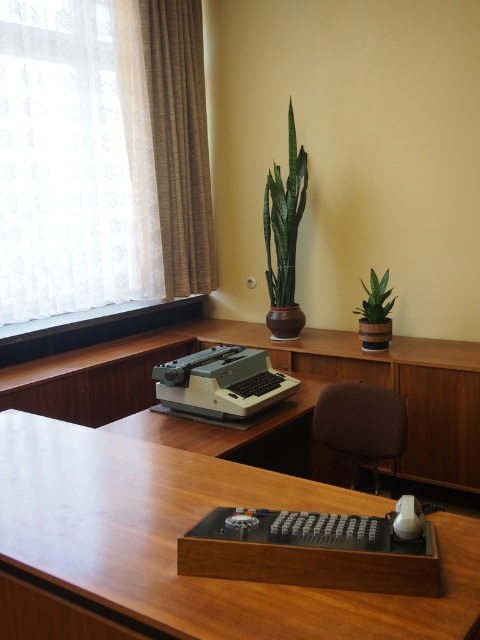
Does point (196, 611) come closer to viewer compared to point (141, 104)?

Yes, it is in front of point (141, 104).

Between wooden desk at center and white sheer curtain at upper left, which one appears on the left side from the viewer's perspective?

Positioned to the left is white sheer curtain at upper left.

Who is more distant from viewer, [0,481] or [204,234]?

Point [204,234]

The height and width of the screenshot is (640, 480). In order to click on wooden desk at center in this screenshot , I will do `click(187, 529)`.

Describe the element at coordinates (165, 147) in the screenshot. I see `white sheer curtain at upper left` at that location.

Can you confirm if white sheer curtain at upper left is thinner than beige fabric curtain at upper left?

No, white sheer curtain at upper left is not thinner than beige fabric curtain at upper left.

Who is more forward, (169, 234) or (201, 44)?

Point (169, 234) is more forward.

The height and width of the screenshot is (640, 480). I want to click on white sheer curtain at upper left, so click(165, 147).

Which is behind, point (156, 8) or point (343, 412)?

Point (156, 8)

Does point (182, 179) come closer to viewer compared to point (333, 449)?

No.

Is point (192, 291) farther from camera compared to point (374, 456)?

That is True.

At what (x,y) coordinates should I click in order to perform the action: click on beige fabric curtain at upper left. Please return your answer as a coordinate pair (x, y). This screenshot has height=640, width=480. Looking at the image, I should click on (167, 141).